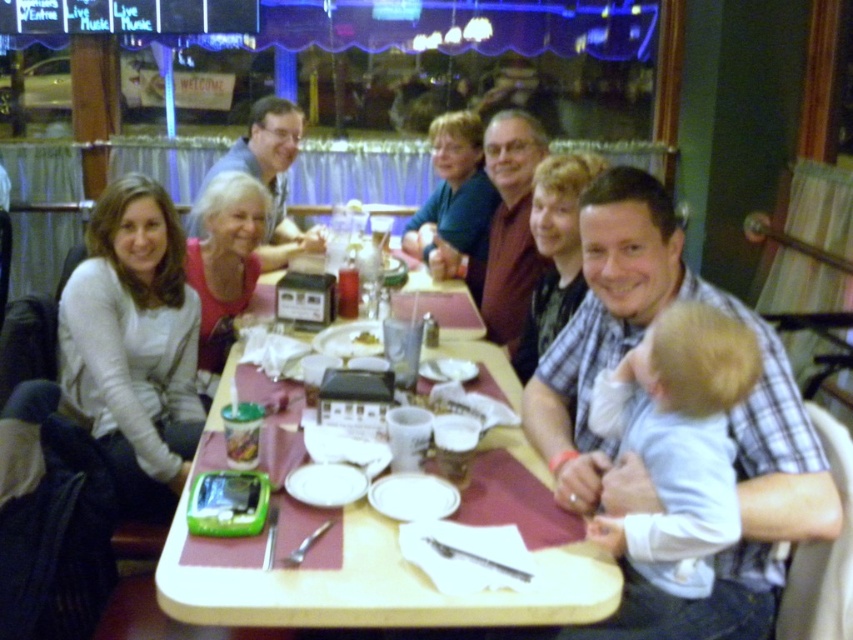
Is wooden table at center bigger than white soft baby at right?

Indeed, wooden table at center has a larger size compared to white soft baby at right.

What do you see at coordinates (374, 586) in the screenshot? This screenshot has width=853, height=640. I see `wooden table at center` at bounding box center [374, 586].

Is point (292, 573) behind point (633, 349)?

No, (292, 573) is in front of (633, 349).

The width and height of the screenshot is (853, 640). I want to click on wooden table at center, so click(x=374, y=586).

Where is `white soft sweater at left`? This screenshot has height=640, width=853. white soft sweater at left is located at coordinates (134, 344).

Is white soft sweater at left wider than wooden table at center?

Incorrect, white soft sweater at left's width does not surpass wooden table at center's.

Is point (189, 285) more distant than point (587, 584)?

Yes, point (189, 285) is farther from viewer.

At what (x,y) coordinates should I click in order to perform the action: click on white soft sweater at left. Please return your answer as a coordinate pair (x, y). Looking at the image, I should click on (134, 344).

Is the position of white soft sweater at left more distant than that of white soft baby at right?

That is True.

Can you confirm if white soft sweater at left is bigger than white soft baby at right?

Yes, white soft sweater at left is bigger than white soft baby at right.

Is point (164, 449) less distant than point (630, 378)?

No, it is behind (630, 378).

Image resolution: width=853 pixels, height=640 pixels. Find the location of `white soft sweater at left`. white soft sweater at left is located at coordinates (134, 344).